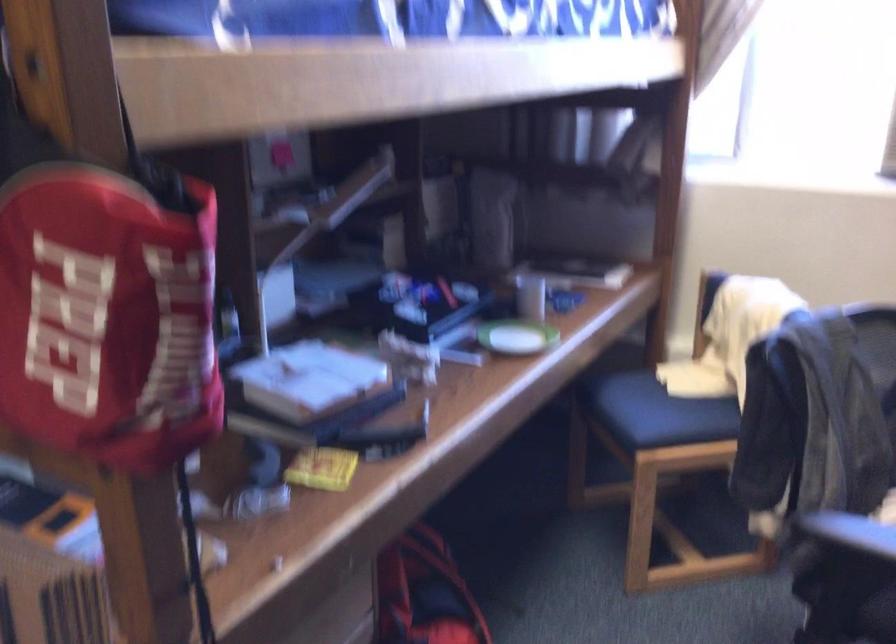
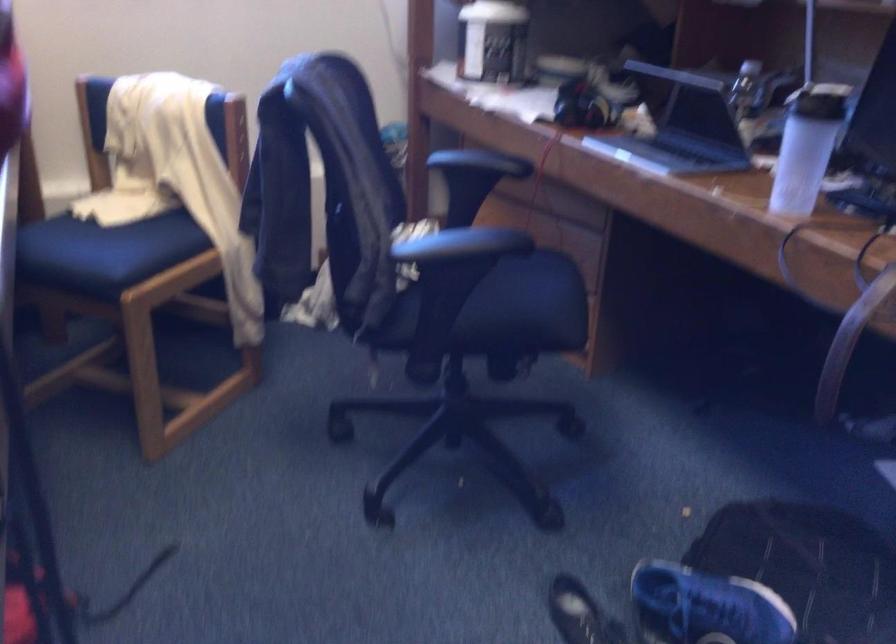
Question: The first image is from the beginning of the video and the second image is from the end. How did the camera likely rotate when shooting the video?

Choices:
 (A) Left
 (B) Right
 (C) Up
 (D) Down

Answer: (B)